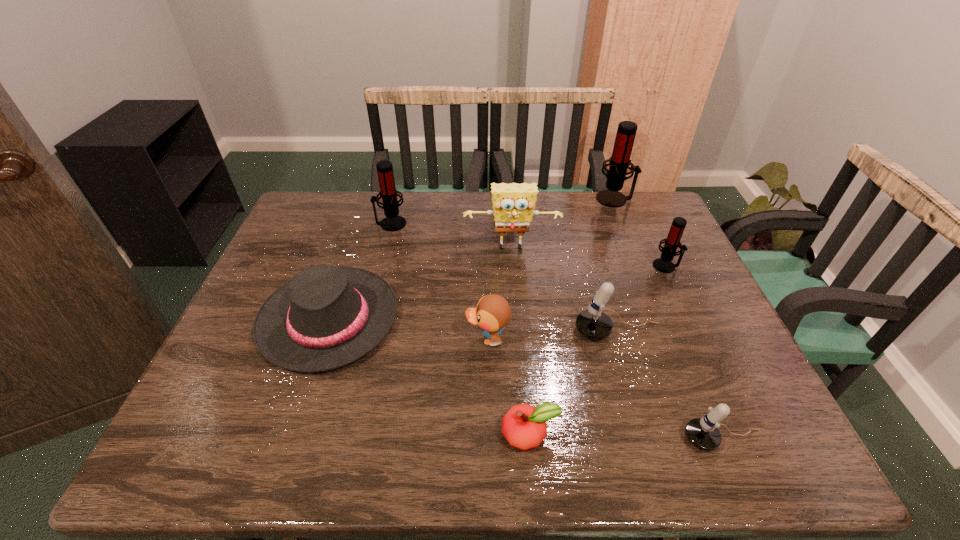
The width and height of the screenshot is (960, 540). In order to click on the farthest red microphone in this screenshot , I will do `click(619, 162)`.

This screenshot has height=540, width=960. Identify the location of the farthest object. (619, 162).

The height and width of the screenshot is (540, 960). I want to click on the leftmost red microphone, so click(x=388, y=193).

Locate an element on the screen. The image size is (960, 540). the second tallest microphone is located at coordinates (388, 193).

Image resolution: width=960 pixels, height=540 pixels. I want to click on the seventh nearest object, so click(513, 204).

Identify the location of sponge. The height and width of the screenshot is (540, 960). (513, 204).

Find the location of a particular element. the fourth farthest microphone is located at coordinates (594, 324).

Where is `the farther white microphone`? the farther white microphone is located at coordinates (594, 324).

At what (x,y) coordinates should I click in order to perform the action: click on the third farthest microphone. Please return your answer as a coordinate pair (x, y). The width and height of the screenshot is (960, 540). Looking at the image, I should click on (663, 264).

Locate an element on the screen. Image resolution: width=960 pixels, height=540 pixels. the smallest red microphone is located at coordinates (663, 264).